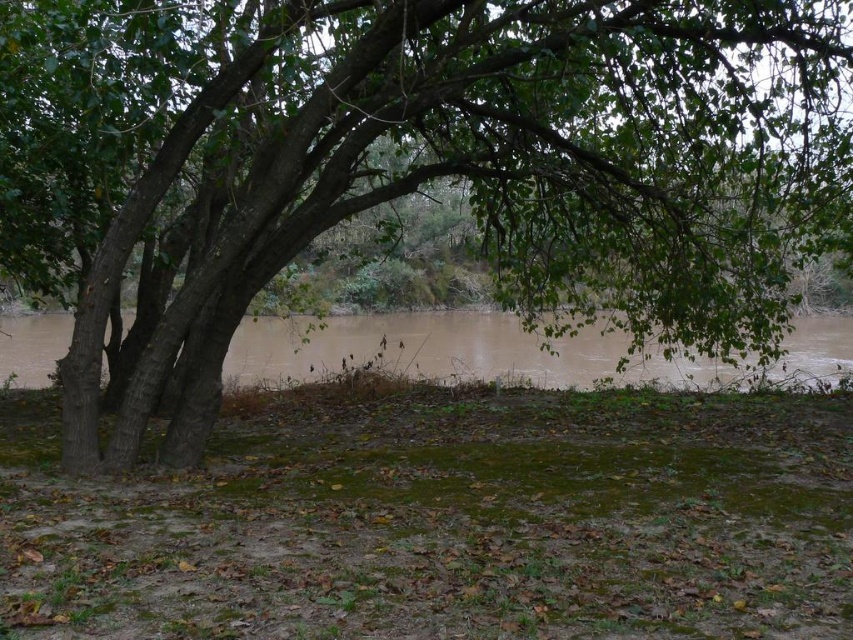
You are standing at the point marked as point (421, 164) in the image. What object is located exactly at that point?

The point (421, 164) is exactly where the green leafy tree at center is located.

You are standing in the outdoor scene and want to cross the brown muddy water at center. The green leafy tree at center is blocking your path. Can you walk under the tree to reach the other side?

The green leafy tree at center is above brown muddy water at center, so you can walk under the tree to reach the other side of the brown muddy water at center.

You are standing in the outdoor scene and want to take a photo of the green leafy tree at center and the brown muddy water at center. Which object will appear larger in your photo?

The green leafy tree at center will appear larger in the photo because it is closer to the viewer than the brown muddy water at center.